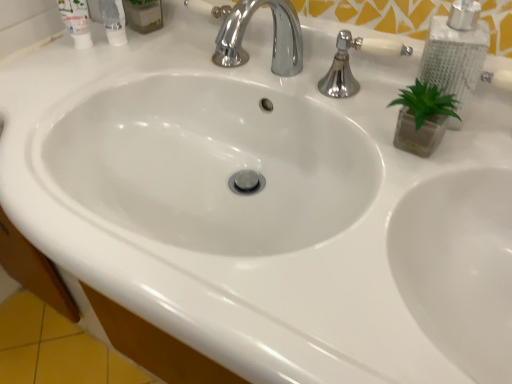
The image size is (512, 384). Identify the location of free spot to the right of chrome metallic faucet at upper center. (346, 100).